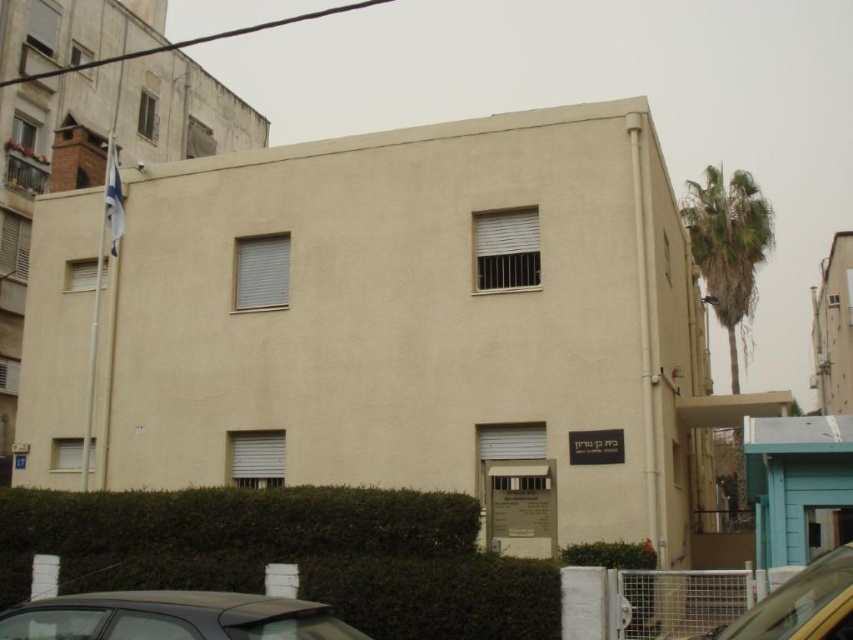
Question: From the image, what is the correct spatial relationship of dark gray matte car at lower left in relation to yellow matte car at lower right?

Choices:
 (A) above
 (B) below

Answer: (B)

Question: Which point is closer to the camera?

Choices:
 (A) (730, 246)
 (B) (236, 604)
 (C) (759, 611)

Answer: (B)

Question: Can you confirm if green leafy palm tree at upper right is bigger than yellow matte car at lower right?

Choices:
 (A) yes
 (B) no

Answer: (A)

Question: Estimate the real-world distances between objects in this image. Which object is closer to the green leafy palm tree at upper right?

Choices:
 (A) yellow matte car at lower right
 (B) dark gray matte car at lower left

Answer: (A)

Question: Which object is positioned farthest from the dark gray matte car at lower left?

Choices:
 (A) green leafy palm tree at upper right
 (B) yellow matte car at lower right

Answer: (A)

Question: Where is dark gray matte car at lower left located in relation to yellow matte car at lower right in the image?

Choices:
 (A) left
 (B) right

Answer: (A)